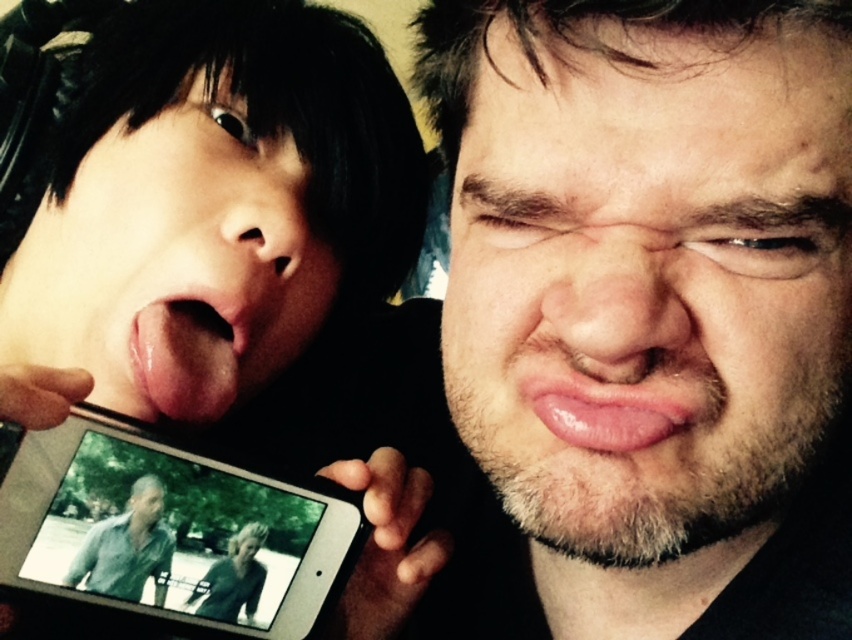
You are trying to take a photo of the matte black phone at upper left and the pink smooth tongue at center. Which object should you focus on first if you want to ensure both are in focus?

The matte black phone at upper left is wider than the pink smooth tongue at center, so you should focus on the matte black phone at upper left first to ensure both are in focus.